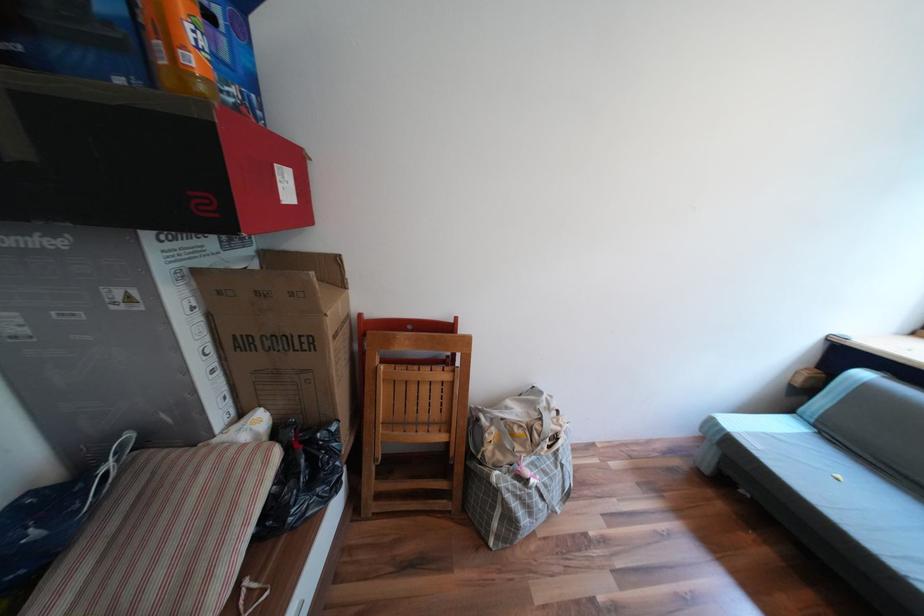
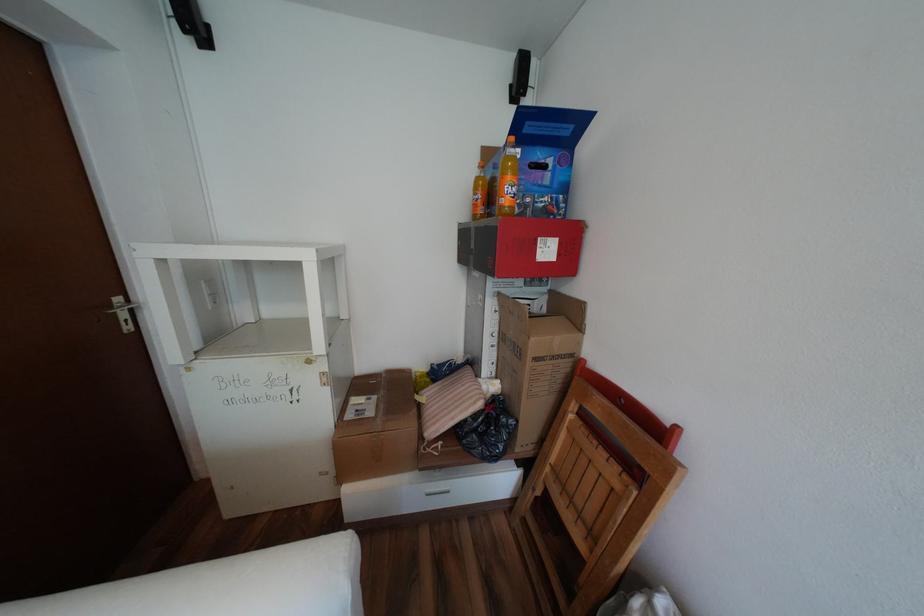
Locate, in the second image, the point that corresponds to (x=219, y=349) in the first image.

(505, 334)